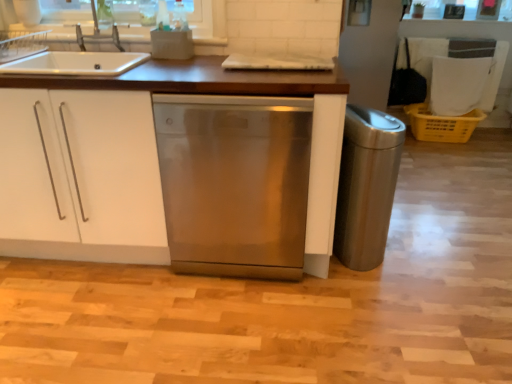
I want to click on vacant space to the right of stainless steel trash can at right, so click(x=425, y=255).